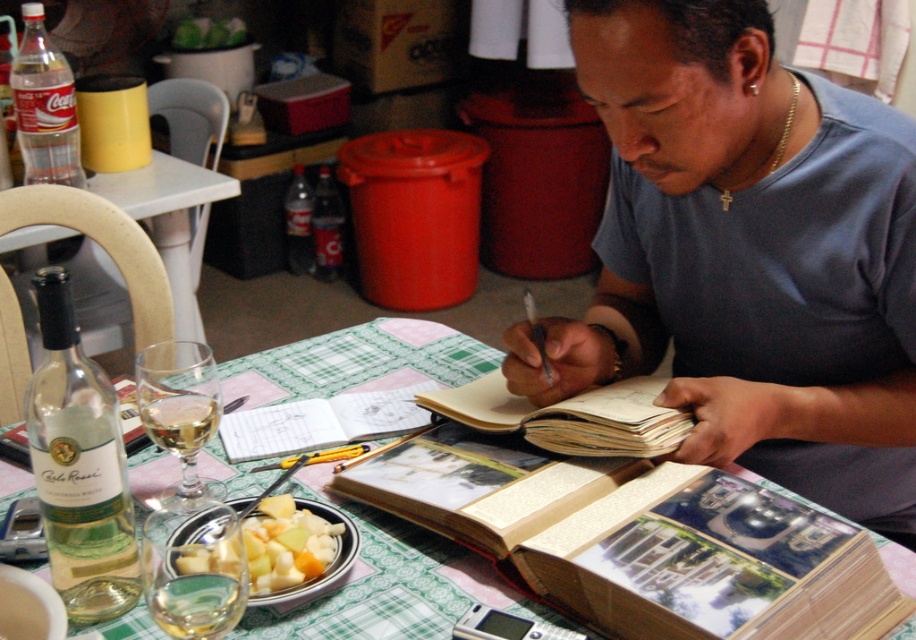
How distant is clear glass wine glass at lower left from clear glass soda bottle at center?

clear glass wine glass at lower left and clear glass soda bottle at center are 2.51 meters apart.

Can you confirm if clear glass wine glass at lower left is smaller than clear glass soda bottle at center?

Correct, clear glass wine glass at lower left occupies less space than clear glass soda bottle at center.

Which is behind, point (214, 512) or point (329, 250)?

Point (329, 250)

Find the location of a particular element. Image resolution: width=916 pixels, height=640 pixels. clear glass wine glass at lower left is located at coordinates (194, 570).

Is yellowish translucent fruit salad at center closer to camera compared to clear glass soda bottle at center?

Yes, yellowish translucent fruit salad at center is in front of clear glass soda bottle at center.

Can you confirm if yellowish translucent fruit salad at center is wider than clear glass soda bottle at center?

Indeed, yellowish translucent fruit salad at center has a greater width compared to clear glass soda bottle at center.

Between point (265, 524) and point (318, 248), which one is positioned behind?

The point (318, 248) is behind.

Locate an element on the screen. The height and width of the screenshot is (640, 916). yellowish translucent fruit salad at center is located at coordinates (295, 548).

Who is positioned more to the right, green fabric table at lower left or clear plastic bottle at center?

Positioned to the right is clear plastic bottle at center.

Is green fabric table at lower left to the left of clear plastic bottle at center from the viewer's perspective?

Correct, you'll find green fabric table at lower left to the left of clear plastic bottle at center.

Is point (12, 243) closer to camera compared to point (293, 256)?

Yes, it is.

The height and width of the screenshot is (640, 916). I want to click on green fabric table at lower left, so click(168, 220).